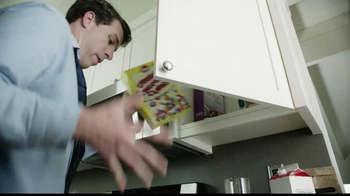
Identify the location of cabinets. This screenshot has width=350, height=196. (236, 57), (146, 50), (116, 68).